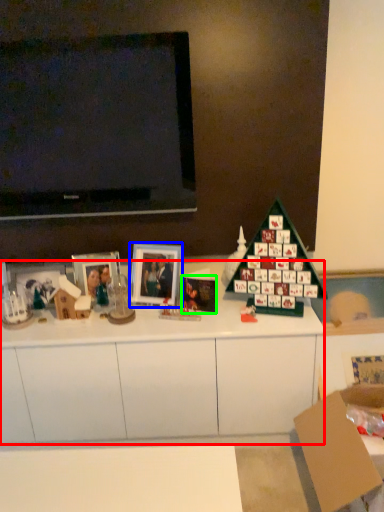
Question: Which object is the closest to the cabinetry (highlighted by a red box)? Choose among these: picture frame (highlighted by a blue box) or christmas card (highlighted by a green box).

Choices:
 (A) picture frame
 (B) christmas card

Answer: (A)